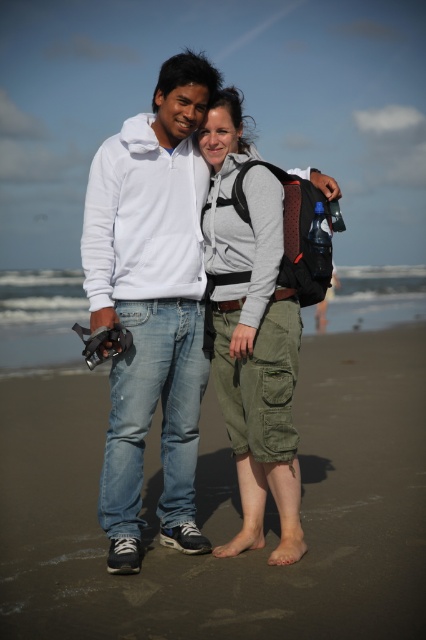
You are standing on the brown sandy beach at lower center and want to take a photo of the white cotton hoodie at center. Since the beach is wet and has footprints, will you be able to stand directly behind the hoodie to take the photo without stepping on the footprints?

The brown sandy beach at lower center is in front of the white cotton hoodie at center, meaning the hoodie is behind the beach area. To take a photo from behind the hoodie, you would need to stand behind it, which would place you further back from the beach. Since the footprints are on the beach area in front of the hoodie, stepping behind the hoodie would avoid the footprints.

You are standing on the brown sandy beach at lower center and want to reach the white cotton hoodie at center. Which direction should you move to get closer to the hoodie?

The brown sandy beach at lower center is on the right side of the white cotton hoodie at center, so you should move to the left to get closer to the hoodie.